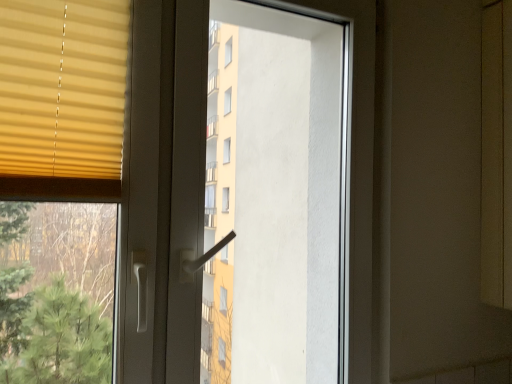
What do you see at coordinates (63, 87) in the screenshot?
I see `yellow matte blinds at upper left` at bounding box center [63, 87].

At what (x,y) coordinates should I click in order to perform the action: click on yellow matte blinds at upper left. Please return your answer as a coordinate pair (x, y). The width and height of the screenshot is (512, 384). Looking at the image, I should click on (63, 87).

Locate an element on the screen. yellow matte blinds at upper left is located at coordinates (63, 87).